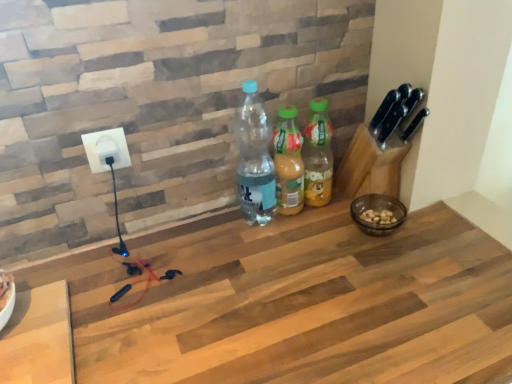
Image resolution: width=512 pixels, height=384 pixels. I want to click on vacant region to the left of transparent plastic bottle at center, which is the first bottle in left-to-right order, so click(x=202, y=236).